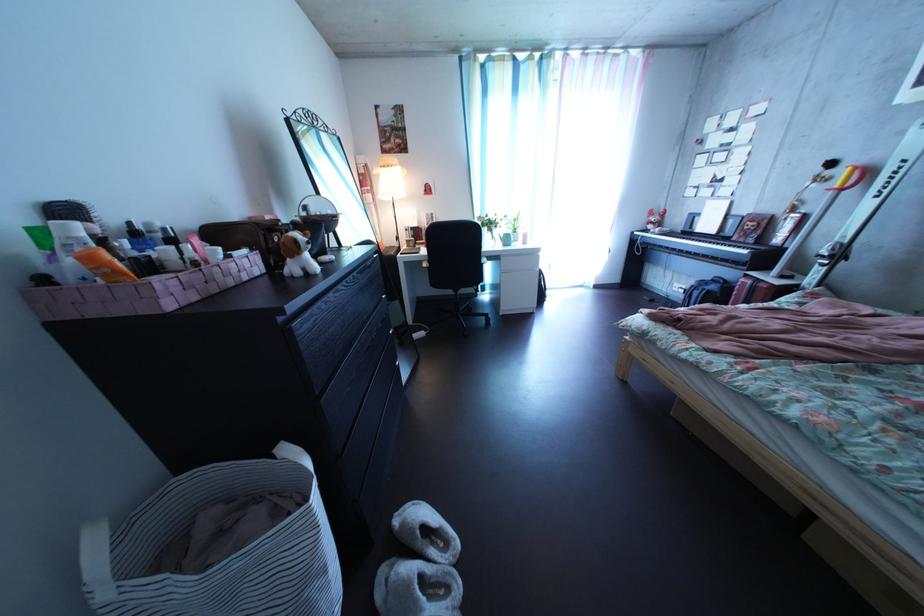
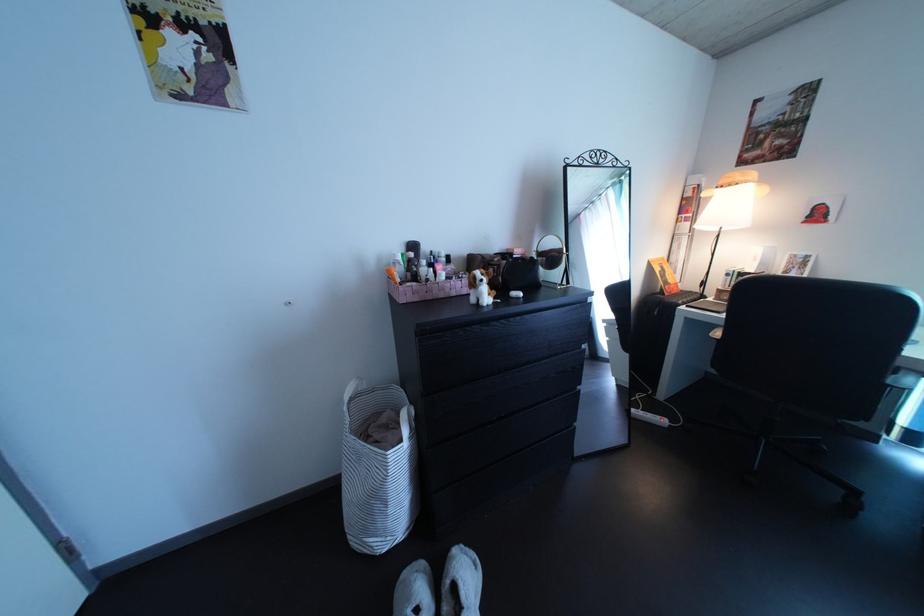
Find the pixel in the second image that matches [375,168] in the first image.

(709, 188)